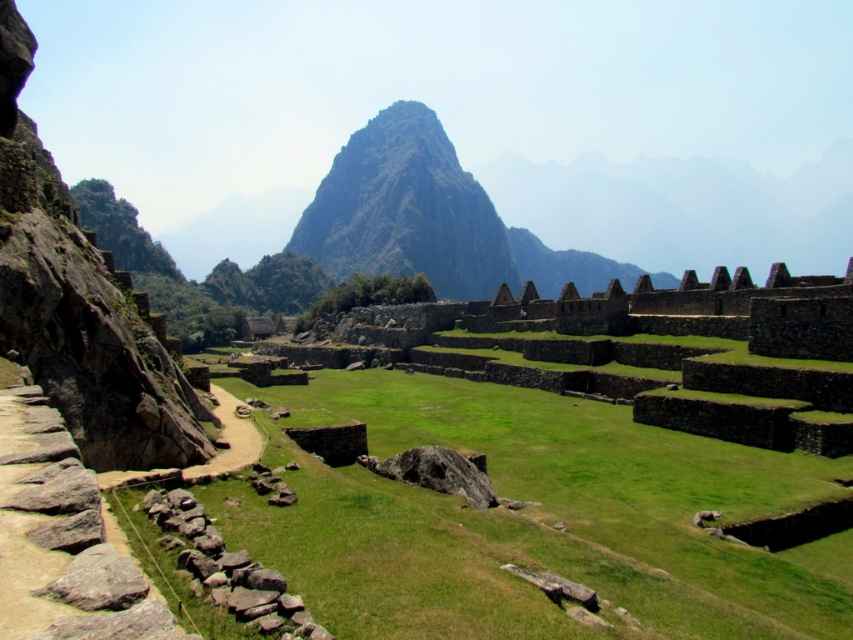
Which is more to the right, green grassy at center or green rocky mountain at center?

From the viewer's perspective, green grassy at center appears more on the right side.

Which of these two, green grassy at center or green rocky mountain at center, stands shorter?

With less height is green grassy at center.

Locate an element on the screen. green grassy at center is located at coordinates (534, 522).

Does green grassy at center have a larger size compared to brown rough stone wall at lower left?

Indeed, green grassy at center has a larger size compared to brown rough stone wall at lower left.

Is green grassy at center thinner than brown rough stone wall at lower left?

No, green grassy at center is not thinner than brown rough stone wall at lower left.

Between point (515, 420) and point (184, 557), which one is positioned behind?

Positioned behind is point (515, 420).

Find the location of a particular element. This screenshot has height=640, width=853. green grassy at center is located at coordinates (534, 522).

Who is positioned more to the left, green rocky mountain at center or brown rough stone wall at lower left?

From the viewer's perspective, green rocky mountain at center appears more on the left side.

Find the location of a particular element. This screenshot has width=853, height=640. green rocky mountain at center is located at coordinates (405, 211).

This screenshot has height=640, width=853. Describe the element at coordinates (405, 211) in the screenshot. I see `green rocky mountain at center` at that location.

Identify the location of green rocky mountain at center. coord(405,211).